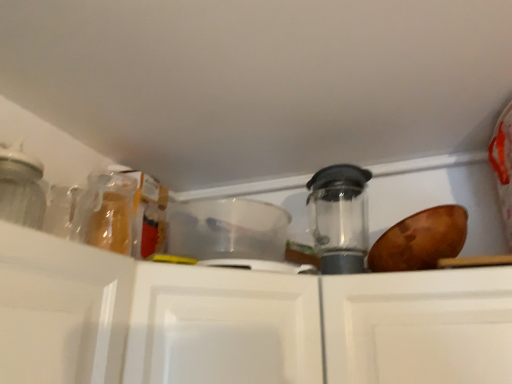
Describe the element at coordinates (241, 321) in the screenshot. I see `white matte cabinet at center` at that location.

Where is `white matte cabinet at center`? Image resolution: width=512 pixels, height=384 pixels. white matte cabinet at center is located at coordinates (241, 321).

Considering the relative positions of transparent plastic blender at center, arranged as the second appliance when viewed from the left, and white matte cabinet at center in the image provided, is transparent plastic blender at center, arranged as the second appliance when viewed from the left, to the right of white matte cabinet at center from the viewer's perspective?

Yes.

Who is taller, transparent plastic blender at center, arranged as the second appliance when viewed from the left, or white matte cabinet at center?

white matte cabinet at center is taller.

This screenshot has width=512, height=384. Identify the location of cabinetry located on the left of transparent plastic blender at center, positioned as the 1th appliance in right-to-left order. (241, 321).

Looking at this image, is white matte cabinet at center at the back of transparent plastic blender at center, positioned as the 1th appliance in right-to-left order?

No, transparent plastic blender at center, positioned as the 1th appliance in right-to-left order,'s orientation is not away from white matte cabinet at center.

From a real-world perspective, which is physically above, white matte cabinet at center or transparent plastic blender at center, arranged as the second appliance when viewed from the left?

From a 3D spatial view, transparent plastic blender at center, arranged as the second appliance when viewed from the left, is above.

Who is shorter, white matte cabinet at center or transparent plastic blender at center, arranged as the second appliance when viewed from the left?

Standing shorter between the two is transparent plastic blender at center, arranged as the second appliance when viewed from the left.

Considering the positions of objects white matte cabinet at center and transparent plastic blender at center, arranged as the second appliance when viewed from the left, in the image provided, who is behind, white matte cabinet at center or transparent plastic blender at center, arranged as the second appliance when viewed from the left,?

transparent plastic blender at center, arranged as the second appliance when viewed from the left, is further from the camera.

Can you confirm if white matte cabinet at center is smaller than transparent plastic blender at center, positioned as the 1th appliance in right-to-left order?

No.

Is point (204, 202) closer or farther from the camera than point (348, 184)?

Point (204, 202).

Considering the sizes of transparent plastic container at center, placed as the 2th appliance when sorted from right to left, and transparent plastic blender at center, arranged as the second appliance when viewed from the left, in the image, is transparent plastic container at center, placed as the 2th appliance when sorted from right to left, bigger or smaller than transparent plastic blender at center, arranged as the second appliance when viewed from the left,?

Considering their sizes, transparent plastic container at center, placed as the 2th appliance when sorted from right to left, takes up less space than transparent plastic blender at center, arranged as the second appliance when viewed from the left.

Can you confirm if transparent plastic container at center, placed as the 2th appliance when sorted from right to left, is taller than transparent plastic blender at center, positioned as the 1th appliance in right-to-left order?

Incorrect, the height of transparent plastic container at center, placed as the 2th appliance when sorted from right to left, is not larger of that of transparent plastic blender at center, positioned as the 1th appliance in right-to-left order.

From a real-world perspective, between transparent plastic container at center, placed as the first appliance when sorted from left to right, and transparent plastic blender at center, arranged as the second appliance when viewed from the left, who is vertically lower?

transparent plastic container at center, placed as the first appliance when sorted from left to right.

Which object is thinner, white matte cabinet at center or transparent plastic container at center, placed as the first appliance when sorted from left to right?

Thinner between the two is transparent plastic container at center, placed as the first appliance when sorted from left to right.

Locate an element on the screen. cabinetry in front of the transparent plastic container at center, placed as the 2th appliance when sorted from right to left is located at coordinates (241, 321).

Considering the positions of objects white matte cabinet at center and transparent plastic container at center, placed as the 2th appliance when sorted from right to left, in the image provided, who is in front, white matte cabinet at center or transparent plastic container at center, placed as the 2th appliance when sorted from right to left,?

white matte cabinet at center is closer to the camera.

Can we say white matte cabinet at center lies outside transparent plastic container at center, placed as the first appliance when sorted from left to right?

Yes, white matte cabinet at center is not within transparent plastic container at center, placed as the first appliance when sorted from left to right.

Is transparent plastic blender at center, positioned as the 1th appliance in right-to-left order, bigger or smaller than transparent plastic container at center, placed as the first appliance when sorted from left to right?

transparent plastic blender at center, positioned as the 1th appliance in right-to-left order, is bigger than transparent plastic container at center, placed as the first appliance when sorted from left to right.

Does point (348, 205) lie in front of point (206, 237)?

No, it is behind (206, 237).

Is transparent plastic blender at center, positioned as the 1th appliance in right-to-left order, next to transparent plastic container at center, placed as the 2th appliance when sorted from right to left, and touching it?

They are not placed beside each other.

From the picture: Considering the positions of objects transparent plastic blender at center, positioned as the 1th appliance in right-to-left order, and transparent plastic container at center, placed as the first appliance when sorted from left to right, in the image provided, who is more to the right, transparent plastic blender at center, positioned as the 1th appliance in right-to-left order, or transparent plastic container at center, placed as the first appliance when sorted from left to right,?

From the viewer's perspective, transparent plastic blender at center, positioned as the 1th appliance in right-to-left order, appears more on the right side.

From a real-world perspective, is transparent plastic container at center, placed as the 2th appliance when sorted from right to left, on top of white matte cabinet at center?

Indeed, from a real-world perspective, transparent plastic container at center, placed as the 2th appliance when sorted from right to left, stands above white matte cabinet at center.

Locate an element on the screen. This screenshot has height=384, width=512. cabinetry that appears on the left of transparent plastic container at center, placed as the first appliance when sorted from left to right is located at coordinates (241, 321).

Could you tell me if transparent plastic container at center, placed as the first appliance when sorted from left to right, is facing white matte cabinet at center?

No, transparent plastic container at center, placed as the first appliance when sorted from left to right, is not oriented towards white matte cabinet at center.

From the image's perspective, is transparent plastic container at center, placed as the first appliance when sorted from left to right, over white matte cabinet at center?

Yes.

The image size is (512, 384). I want to click on the 2nd appliance behind the white matte cabinet at center, so click(x=339, y=217).

Starting from the white matte cabinet at center, which appliance is the 2nd one to the right? Please provide its 2D coordinates.

[(339, 217)]

When comparing their distances from transparent plastic container at center, placed as the first appliance when sorted from left to right, does transparent plastic blender at center, positioned as the 1th appliance in right-to-left order, or white matte cabinet at center seem closer?

The object closer to transparent plastic container at center, placed as the first appliance when sorted from left to right, is transparent plastic blender at center, positioned as the 1th appliance in right-to-left order.

Estimate the real-world distances between objects in this image. Which object is closer to transparent plastic blender at center, positioned as the 1th appliance in right-to-left order, transparent plastic container at center, placed as the first appliance when sorted from left to right, or white matte cabinet at center?

The object closer to transparent plastic blender at center, positioned as the 1th appliance in right-to-left order, is transparent plastic container at center, placed as the first appliance when sorted from left to right.

Looking at the image, which one is located closer to white matte cabinet at center, transparent plastic blender at center, positioned as the 1th appliance in right-to-left order, or transparent plastic container at center, placed as the 2th appliance when sorted from right to left?

The object closer to white matte cabinet at center is transparent plastic container at center, placed as the 2th appliance when sorted from right to left.

When comparing their distances from transparent plastic blender at center, arranged as the second appliance when viewed from the left, does white matte cabinet at center or transparent plastic container at center, placed as the first appliance when sorted from left to right, seem further?

white matte cabinet at center is positioned further to the anchor transparent plastic blender at center, arranged as the second appliance when viewed from the left.

Estimate the real-world distances between objects in this image. Which object is closer to white matte cabinet at center, transparent plastic container at center, placed as the first appliance when sorted from left to right, or transparent plastic blender at center, positioned as the 1th appliance in right-to-left order?

Among the two, transparent plastic container at center, placed as the first appliance when sorted from left to right, is located nearer to white matte cabinet at center.

Looking at the image, which one is located closer to transparent plastic container at center, placed as the 2th appliance when sorted from right to left, white matte cabinet at center or transparent plastic blender at center, positioned as the 1th appliance in right-to-left order?

transparent plastic blender at center, positioned as the 1th appliance in right-to-left order, lies closer to transparent plastic container at center, placed as the 2th appliance when sorted from right to left, than the other object.

You are a GUI agent. You are given a task and a screenshot of the screen. Output one action in this format:
    pyautogui.click(x=<x>, y=<y>)
    Task: Click on the appliance situated between white matte cabinet at center and transparent plastic blender at center, arranged as the second appliance when viewed from the left, from left to right
    The width and height of the screenshot is (512, 384).
    Given the screenshot: What is the action you would take?
    pyautogui.click(x=227, y=229)